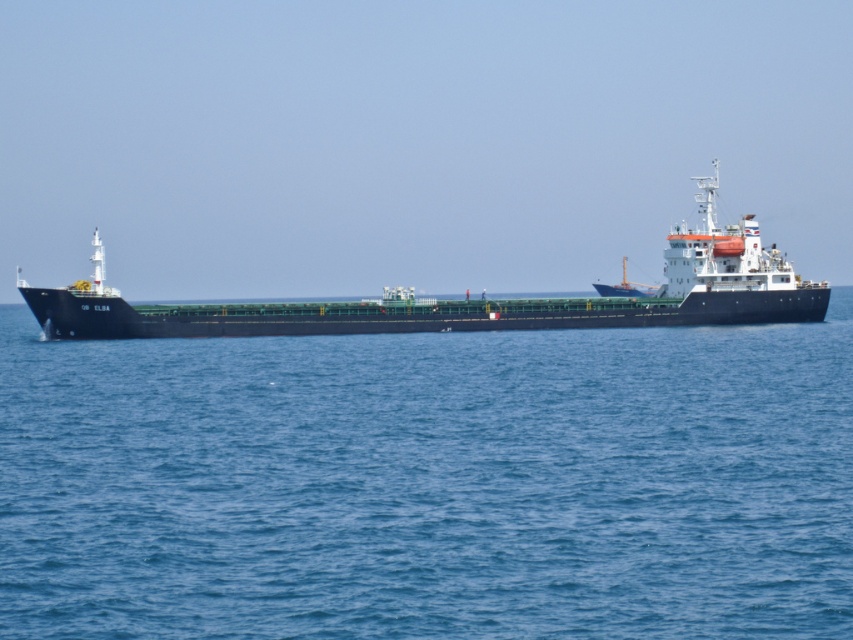
You are standing on the deck of the green matte ship at center and want to observe the blue water at center. In which direction should you look relative to your position on the ship?

The blue water at center is to the right of the green matte ship at center, so you should look to your right to see the blue water at center.

You are standing on the deck of the cargo ship OB ELBA and looking towards the point at coordinates (428,483). What do you see in that direction?

You see blue water at center in the direction of the point at coordinates (428,483).

You are a maritime engineer assessing the safety of the green matte ship at center. You need to ensure that the ship maintains a minimum safe distance of 60 feet from the blue water at center to avoid potential collisions. Based on the given information, is the current distance sufficient?

The distance between the blue water at center and the green matte ship at center is 58.93 feet, which is less than the required 60 feet. Therefore, the current distance is not sufficient to ensure safety against potential collisions.